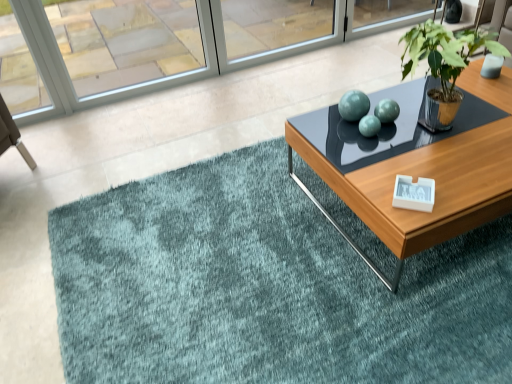
At what (x,y) coordinates should I click in order to perform the action: click on vacant area situated to the left side of wooden glossy coffee table at center. Please return your answer as a coordinate pair (x, y). This screenshot has width=512, height=384. Looking at the image, I should click on tap(234, 238).